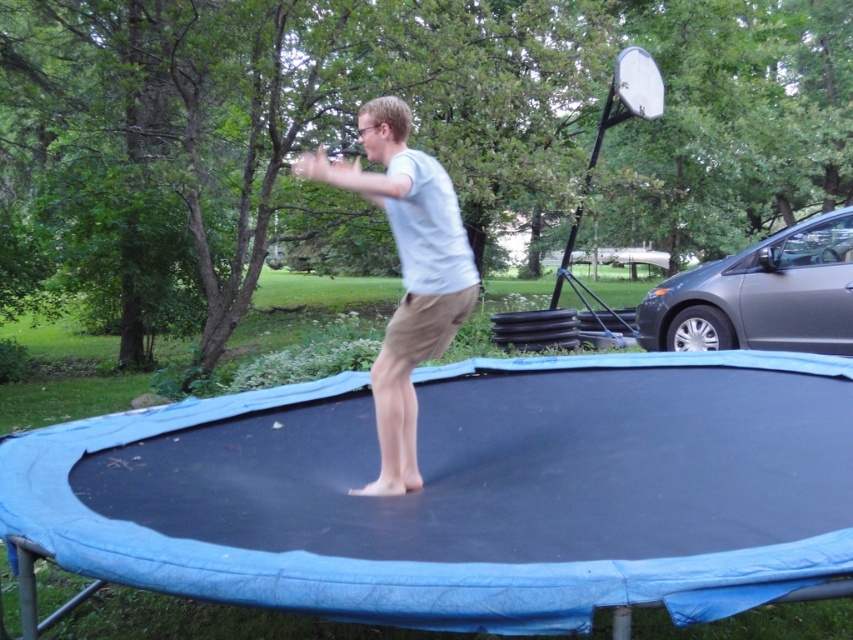
Which is above, white matte shirt at center or gray metallic car at right?

gray metallic car at right is higher up.

Is point (419, 291) farther from camera compared to point (815, 285)?

No, it is not.

Is point (399, 400) closer to camera compared to point (705, 307)?

Yes, it is.

At what (x,y) coordinates should I click in order to perform the action: click on white matte shirt at center. Please return your answer as a coordinate pair (x, y). This screenshot has height=640, width=853. Looking at the image, I should click on (405, 273).